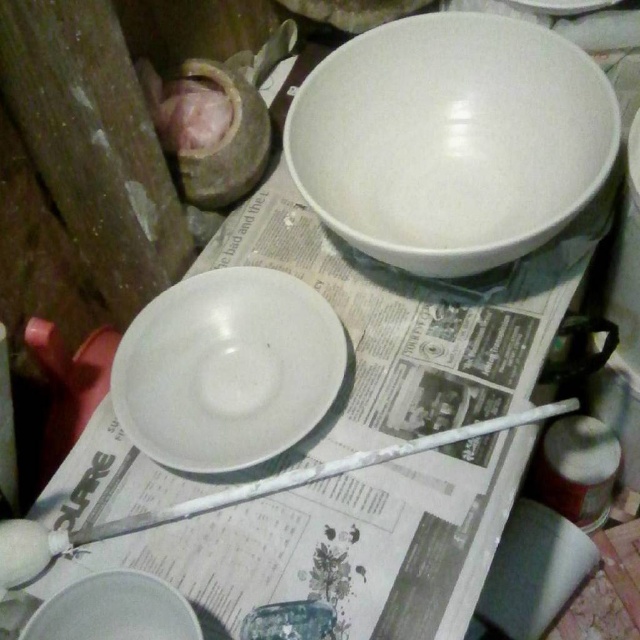
You are standing in front of the workspace and want to place a small tool between the two points labeled point (195, 374) and point (545, 445). Which point should you place it closer to if you want the tool to be more visible to someone approaching from the front?

You should place the tool closer to point (195, 374) because it is closer to the viewer than point (545, 445), making it more visible to someone approaching from the front.

You are a pottery student who wants to place a new bowl on the workspace. The bowl has a diameter of 12 inches. The point at coordinate point (250, 356) is where you want to place it. Can you determine if the bowl will fit at that location without overlapping other objects?

The distance of point (250, 356) from camera is 32.71 inches, but the question does not provide information about the size or position of other objects in the workspace. Therefore, it is impossible to determine if the bowl will overlap with other objects at that location.

You are an apprentice potter and need to place a new bowl exactly where the white glossy bowl at upper center was. According to the coordinates provided, where should you place the new bowl?

The white glossy bowl at upper center should be placed at coordinates point (451, 140) as specified.